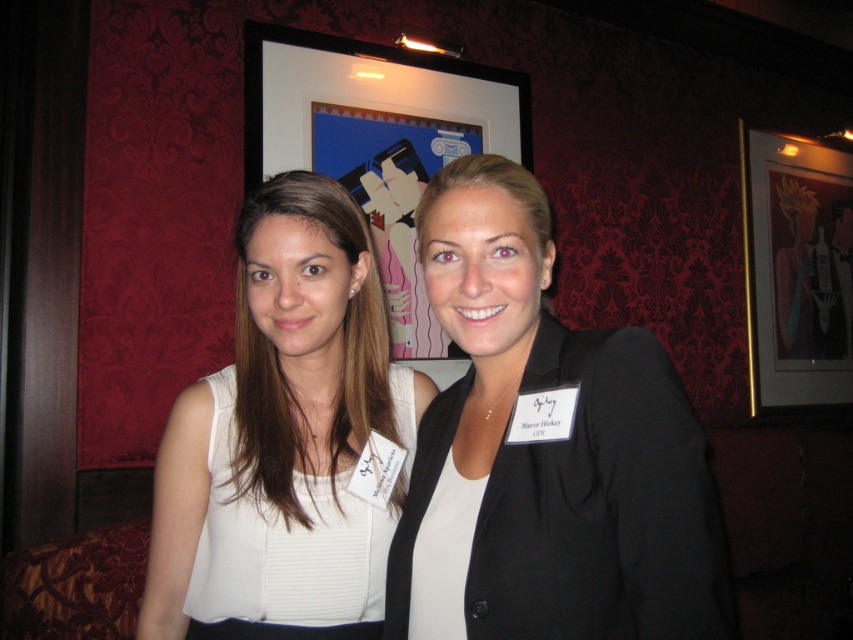
Question: Can you confirm if black matte blazer at center is smaller than white matte dress at center?

Choices:
 (A) no
 (B) yes

Answer: (A)

Question: Which is farther from the black matte blazer at center?

Choices:
 (A) black framed picture at upper center
 (B) matte black frame at upper center
 (C) white matte dress at center

Answer: (B)

Question: Considering the real-world distances, which object is farthest from the white matte dress at center?

Choices:
 (A) black framed picture at upper center
 (B) black matte blazer at center

Answer: (A)

Question: Does black framed picture at upper center have a greater width compared to matte black frame at upper center?

Choices:
 (A) yes
 (B) no

Answer: (A)

Question: Which object appears farthest from the camera in this image?

Choices:
 (A) black matte blazer at center
 (B) white matte dress at center

Answer: (B)

Question: Does black matte blazer at center have a larger size compared to matte black frame at upper center?

Choices:
 (A) yes
 (B) no

Answer: (B)